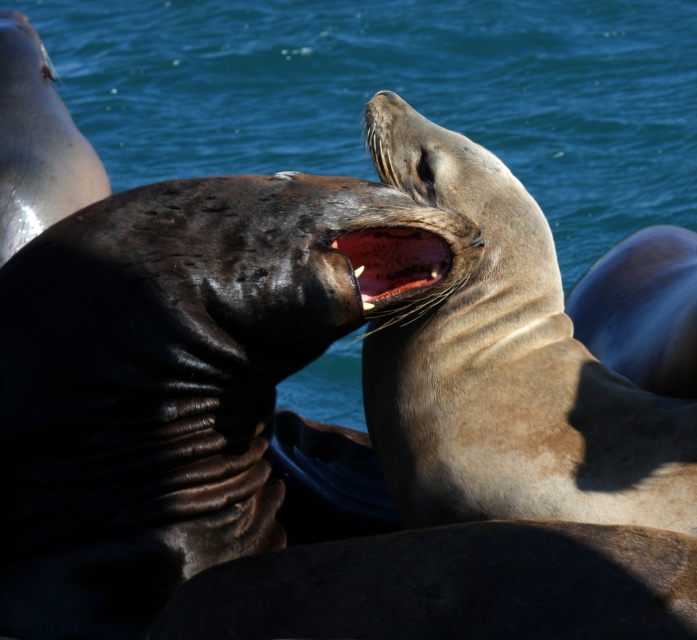
Which is more to the right, smooth gray seal mouth at upper right or smooth pinkish-red gums at center?

From the viewer's perspective, smooth gray seal mouth at upper right appears more on the right side.

Who is more distant from viewer, (x=376, y=380) or (x=383, y=285)?

The point (x=376, y=380) is more distant.

Image resolution: width=697 pixels, height=640 pixels. In order to click on smooth gray seal mouth at upper right in this screenshot , I will do `click(507, 369)`.